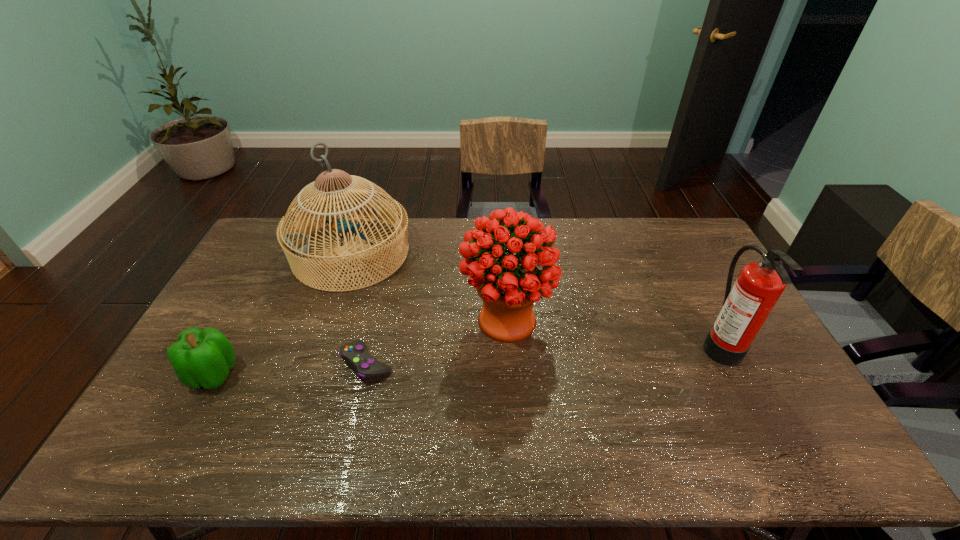
Locate an element on the screen. The height and width of the screenshot is (540, 960). birdcage is located at coordinates (296, 246).

Locate an element on the screen. The image size is (960, 540). bouquet is located at coordinates (509, 285).

Where is `the rightmost object`? The height and width of the screenshot is (540, 960). the rightmost object is located at coordinates (746, 307).

You are a GUI agent. You are given a task and a screenshot of the screen. Output one action in this format:
    pyautogui.click(x=<x>, y=<y>)
    Task: Click on the fourth tallest object
    This screenshot has height=540, width=960.
    Given the screenshot: What is the action you would take?
    pyautogui.click(x=200, y=358)

Where is `control`? This screenshot has height=540, width=960. control is located at coordinates (354, 354).

At what (x,y) coordinates should I click in order to perform the action: click on free space located 0.120m on the right of the birdcage. Please return your answer as a coordinate pair (x, y). Looking at the image, I should click on (445, 253).

Locate an element on the screen. free region located on the front of the fourth object from left to right is located at coordinates (x=514, y=441).

At what (x,y) coordinates should I click in order to perform the action: click on free space located on the front-facing side of the fire extinguisher. Please return your answer as a coordinate pair (x, y). The height and width of the screenshot is (540, 960). Looking at the image, I should click on [591, 343].

Locate an element on the screen. Image resolution: width=960 pixels, height=540 pixels. vacant space located on the front-facing side of the fire extinguisher is located at coordinates (615, 343).

Where is `free space located on the front-facing side of the fire extinguisher`? free space located on the front-facing side of the fire extinguisher is located at coordinates (609, 343).